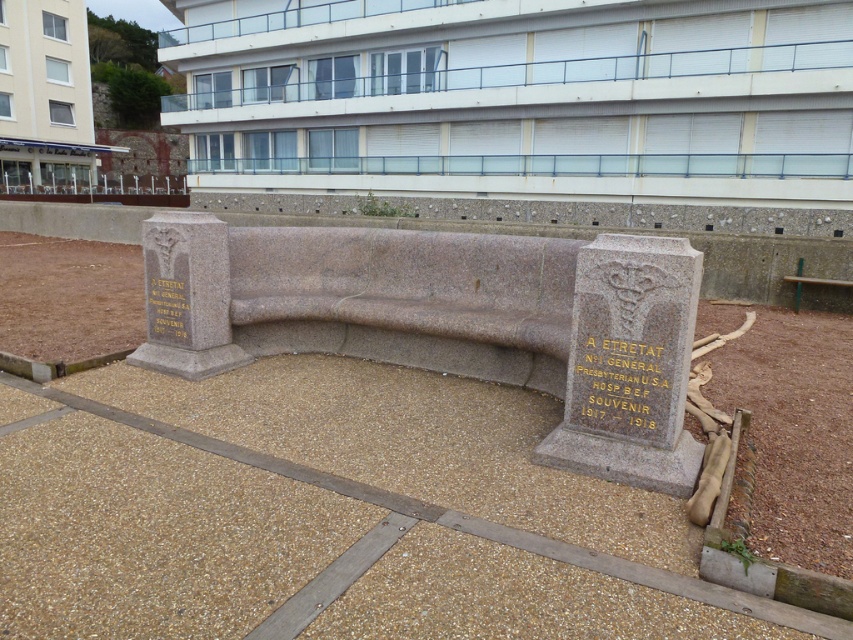
Between granite bench at center and gold metallic plaque at left, which one is positioned higher?

granite bench at center

This screenshot has height=640, width=853. What do you see at coordinates (462, 321) in the screenshot?
I see `granite bench at center` at bounding box center [462, 321].

Is point (384, 234) positioned in front of point (172, 288)?

No.

Where is `granite bench at center`? The width and height of the screenshot is (853, 640). granite bench at center is located at coordinates (462, 321).

Does point (537, 328) come closer to viewer compared to point (613, 378)?

No, (537, 328) is further to viewer.

Which is more to the left, granite bench at center or goldmaterial/textureinscription at center?

Positioned to the left is granite bench at center.

Does point (558, 342) come behind point (656, 445)?

Yes, point (558, 342) is farther from viewer.

I want to click on granite bench at center, so click(x=462, y=321).

Can you confirm if goldmaterial/textureinscription at center is wider than gold metallic plaque at left?

Indeed, goldmaterial/textureinscription at center has a greater width compared to gold metallic plaque at left.

Is point (663, 355) less distant than point (175, 316)?

Yes, point (663, 355) is closer to viewer.

Where is `goldmaterial/textureinscription at center`? goldmaterial/textureinscription at center is located at coordinates (621, 385).